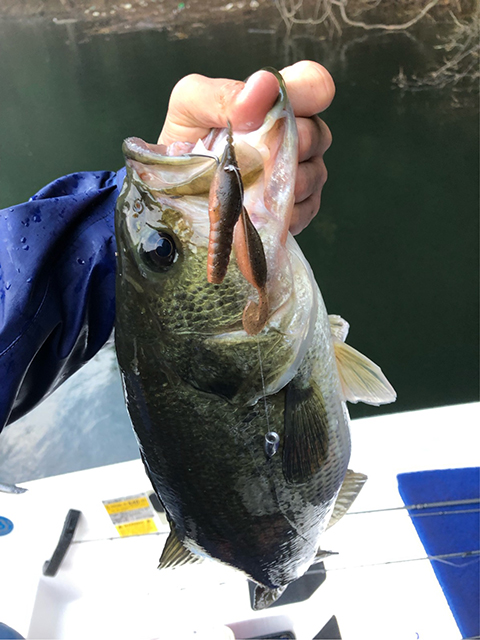
Where is `handle`? The height and width of the screenshot is (640, 480). handle is located at coordinates (64, 539).